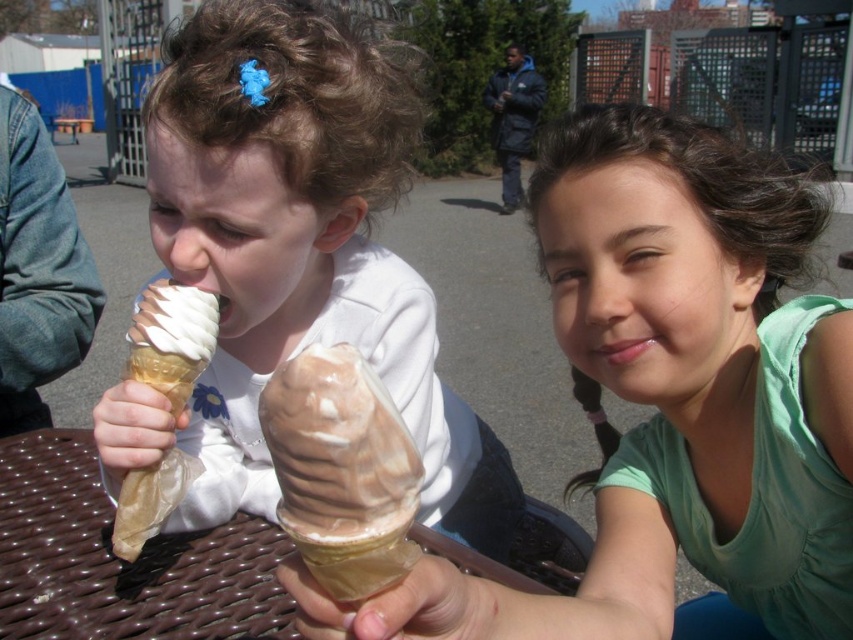
Looking at this image, you are a photographer trying to capture both ice creams in a single shot. The swirled chocolate ice cream at center and the vanilla and chocolate ice cream at left are of different heights. Which ice cream should you focus on first to ensure both are in frame without moving the camera?

The swirled chocolate ice cream at center is shorter than the vanilla and chocolate ice cream at left. To ensure both are in frame, focus on the taller vanilla and chocolate ice cream at left first, then adjust the camera angle slightly downward to include the shorter swirled chocolate ice cream at center.

You are a photographer trying to capture both the matte brown ice cream cone at center and the swirled chocolate ice cream at center in a single shot. Since you want to highlight the taller object, which one should you focus on?

The matte brown ice cream cone at center is taller than the swirled chocolate ice cream at center, so you should focus on the matte brown ice cream cone at center to highlight the taller object.